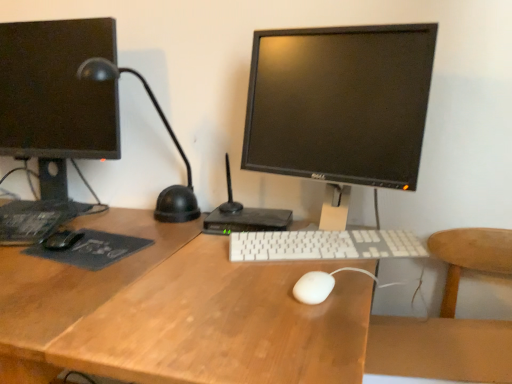
Question: From the image's perspective, is white matte mouse at center, which ranks as the 1th mouse in bottom-to-top order, above or below white plastic keyboard at center?

Choices:
 (A) above
 (B) below

Answer: (B)

Question: Is white matte mouse at center, placed as the first mouse when sorted from right to left, bigger or smaller than white plastic keyboard at center?

Choices:
 (A) big
 (B) small

Answer: (B)

Question: Which is nearer to the wooden at right?

Choices:
 (A) black glossy monitor at center, which is counted as the first computer monitor, starting from the right
 (B) white matte mouse at center, which appears as the first mouse when viewed from the front
 (C) black matte mouse at left, which is the 1th mouse in left-to-right order
 (D) dark gray matte mousepad at left
 (E) black plastic router at center

Answer: (B)

Question: Based on their relative distances, which object is farther from the black matte desk lamp at left?

Choices:
 (A) black plastic router at center
 (B) matte black monitor at left, which is counted as the second computer monitor, starting from the right
 (C) wooden at right
 (D) white matte mouse at center, arranged as the second mouse when viewed from the top
 (E) dark gray matte mousepad at left

Answer: (C)